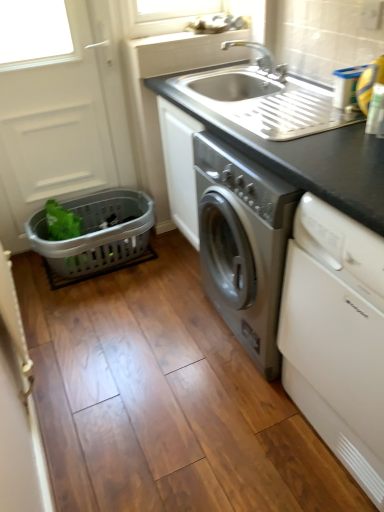
Question: Relative to silver metallic faucet at upper center, is black matte sink at upper center in front or behind?

Choices:
 (A) behind
 (B) front

Answer: (B)

Question: Considering the positions of black matte sink at upper center and silver metallic faucet at upper center in the image, is black matte sink at upper center bigger or smaller than silver metallic faucet at upper center?

Choices:
 (A) small
 (B) big

Answer: (B)

Question: Which object is positioned farthest from the gray plastic basket at lower left?

Choices:
 (A) satin silver washing machine at center
 (B) black matte sink at upper center
 (C) green plastic basket at left
 (D) white matte screen door at left
 (E) white glossy dishwasher at lower right

Answer: (E)

Question: Which of these objects is positioned closest to the gray plastic basket at lower left?

Choices:
 (A) satin silver washing machine at center
 (B) green plastic basket at left
 (C) white matte screen door at left
 (D) silver metallic faucet at upper center
 (E) white glossy dishwasher at lower right

Answer: (B)